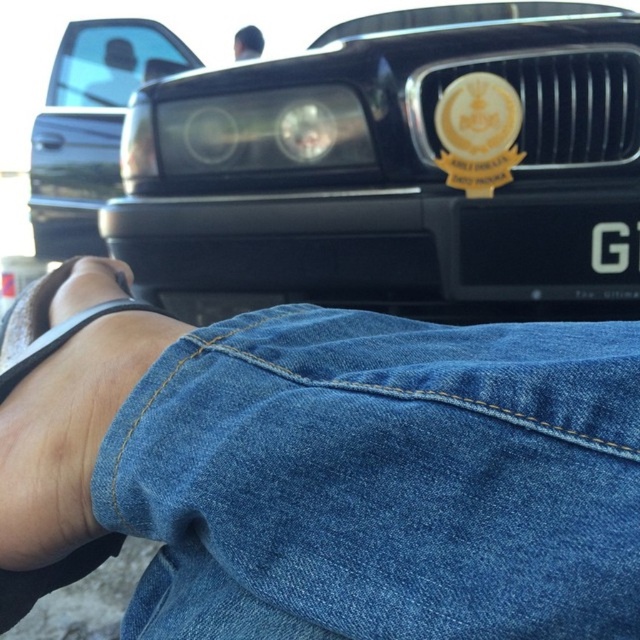
Which is more to the left, black glossy bumper at center or matte black car at upper left?

matte black car at upper left

Between black glossy bumper at center and matte black car at upper left, which one has more height?

Standing taller between the two is matte black car at upper left.

Who is more distant from viewer, (266,230) or (129,60)?

Positioned behind is point (129,60).

At what (x,y) coordinates should I click in order to perform the action: click on black glossy bumper at center. Please return your answer as a coordinate pair (x, y). The image size is (640, 640). Looking at the image, I should click on (381, 244).

Does denim at lower right have a smaller size compared to matte black toe at lower left?

Incorrect, denim at lower right is not smaller in size than matte black toe at lower left.

Which is more to the right, denim at lower right or matte black toe at lower left?

From the viewer's perspective, denim at lower right appears more on the right side.

Is point (316, 465) farther from camera compared to point (125, 292)?

No, (316, 465) is closer to viewer.

This screenshot has width=640, height=640. What are the coordinates of `denim at lower right` in the screenshot? It's located at (381, 480).

Is black glossy car at center to the right of matte black toe at lower left from the viewer's perspective?

Indeed, black glossy car at center is positioned on the right side of matte black toe at lower left.

Is point (595, 184) closer to viewer compared to point (115, 276)?

No.

The height and width of the screenshot is (640, 640). In order to click on black glossy car at center in this screenshot , I will do `click(392, 172)`.

Image resolution: width=640 pixels, height=640 pixels. I want to click on black glossy car at center, so [392, 172].